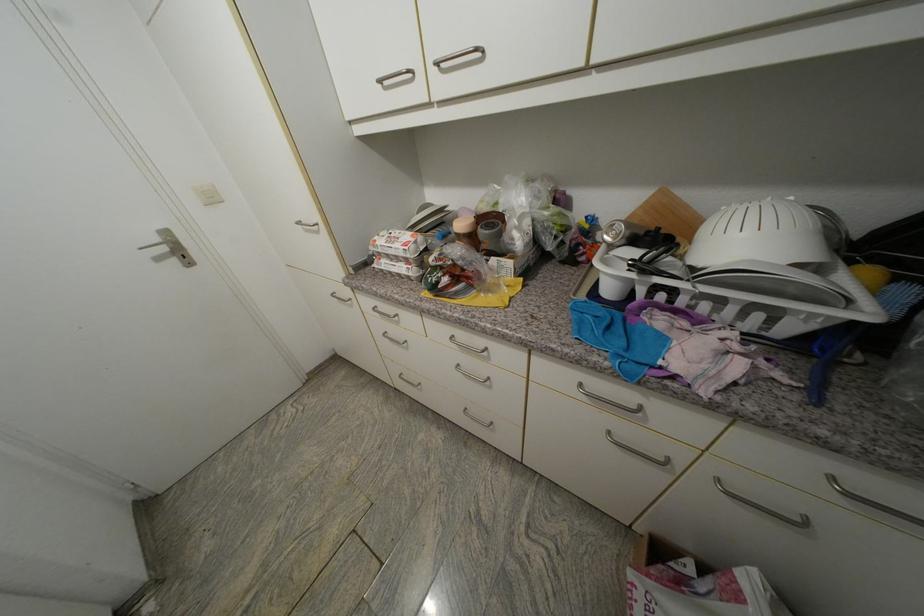
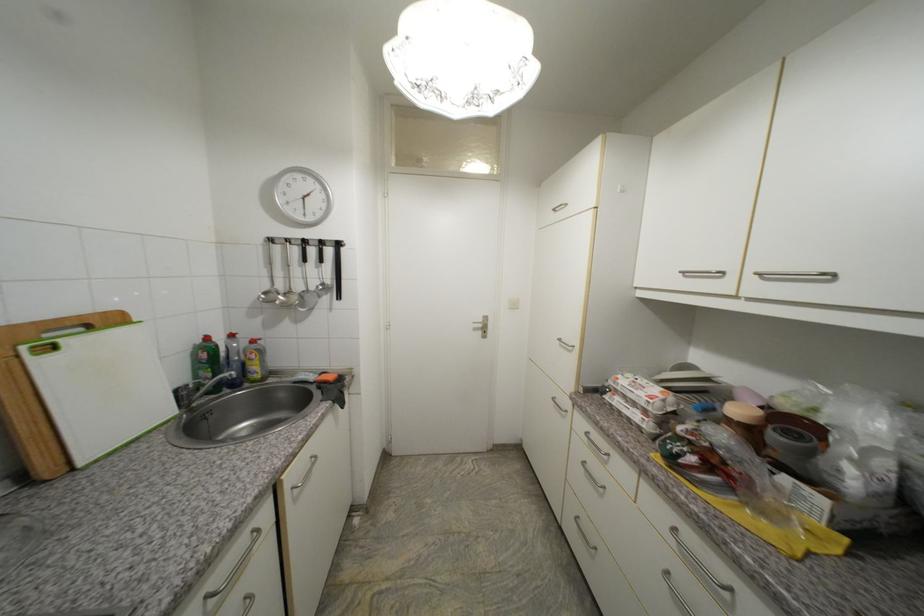
Locate, in the second image, the point that corresponds to (x=477, y=238) in the first image.

(756, 432)